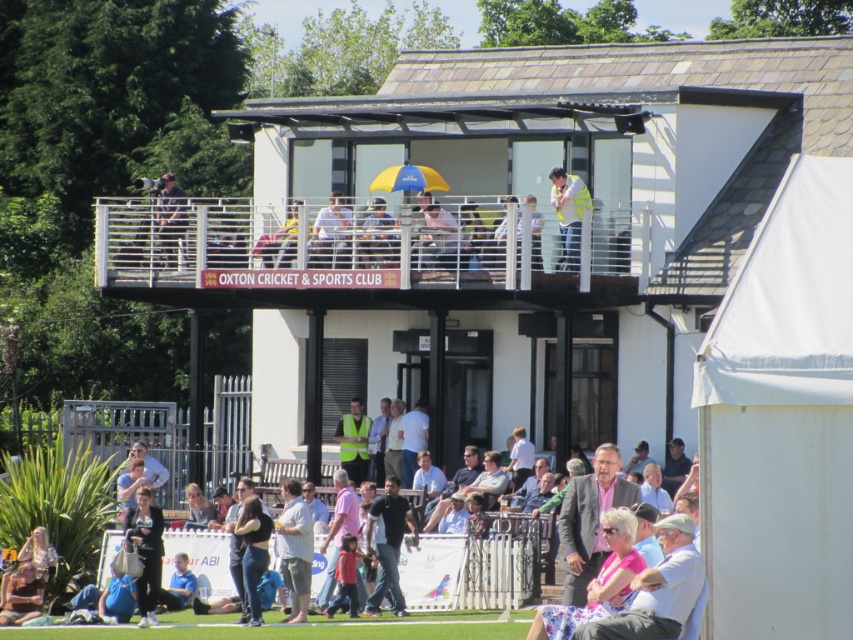
Between light blue shirt at lower center and yellow fabric umbrella at upper center, which one appears on the left side from the viewer's perspective?

From the viewer's perspective, yellow fabric umbrella at upper center appears more on the left side.

Which is below, light blue shirt at lower center or yellow fabric umbrella at upper center?

light blue shirt at lower center

Is point (440, 604) farther from viewer compared to point (294, 252)?

No.

Where is `light blue shirt at lower center`? This screenshot has width=853, height=640. light blue shirt at lower center is located at coordinates (480, 566).

Between white metal railing at upper center and matte black jacket at upper center, which one is positioned higher?

matte black jacket at upper center

Consider the image. Is white metal railing at upper center to the left of matte black jacket at upper center from the viewer's perspective?

Incorrect, white metal railing at upper center is not on the left side of matte black jacket at upper center.

Between point (341, 298) and point (164, 218), which one is positioned in front?

Point (341, 298) is in front.

Find the location of `white metal railing at upper center`. white metal railing at upper center is located at coordinates (351, 259).

You are a GUI agent. You are given a task and a screenshot of the screen. Output one action in this format:
    pyautogui.click(x=<x>, y=<y>)
    Task: Click on the white metal railing at upper center
    
    Given the screenshot: What is the action you would take?
    click(351, 259)

Does white metal railing at upper center lie in front of reflective silver camera at upper center?

Yes, it is in front of reflective silver camera at upper center.

Which is in front, point (306, 294) or point (552, 196)?

Positioned in front is point (552, 196).

You are a GUI agent. You are given a task and a screenshot of the screen. Output one action in this format:
    pyautogui.click(x=<x>, y=<y>)
    Task: Click on the white metal railing at upper center
    
    Given the screenshot: What is the action you would take?
    pyautogui.click(x=351, y=259)